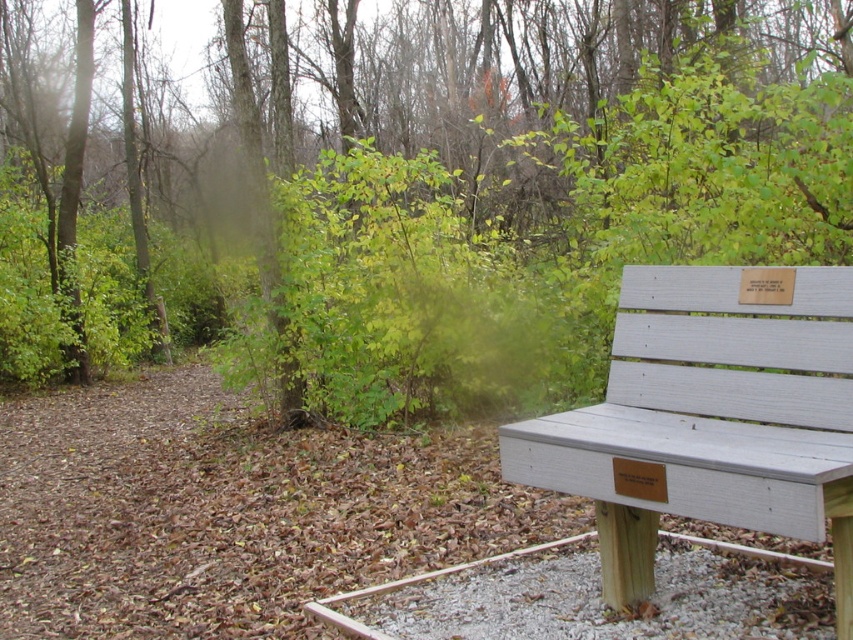
Does point (202, 132) come in front of point (708, 376)?

No, (202, 132) is further to viewer.

Does green leafy tree at upper right appear over white painted wood bench at right?

Indeed, green leafy tree at upper right is positioned over white painted wood bench at right.

Which is in front, point (631, 0) or point (672, 291)?

Point (672, 291) is more forward.

This screenshot has width=853, height=640. Identify the location of green leafy tree at upper right. (424, 192).